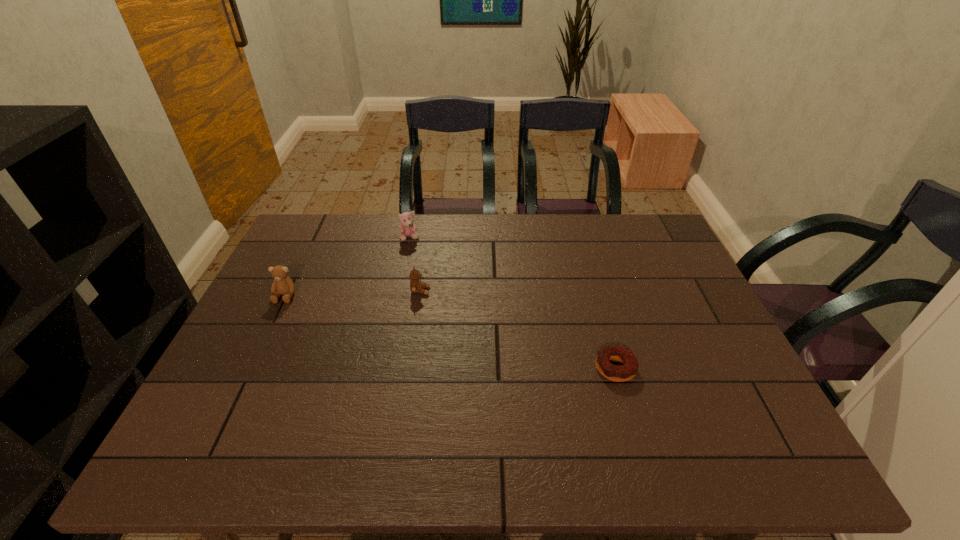
Find the location of a particular element. The height and width of the screenshot is (540, 960). vacant space that's between the leftmost object and the third object from right to left is located at coordinates (348, 267).

The width and height of the screenshot is (960, 540). I want to click on vacant region between the second teddy bear from left to right and the doughnut, so click(513, 303).

The image size is (960, 540). In order to click on free space between the nearest object and the second teddy bear from left to right in this screenshot , I will do `click(513, 303)`.

Find the location of a particular element. This screenshot has width=960, height=540. vacant area that lies between the second object from left to right and the rightmost teddy bear is located at coordinates (415, 264).

At what (x,y) coordinates should I click in order to perform the action: click on free spot between the farthest teddy bear and the leftmost teddy bear. Please return your answer as a coordinate pair (x, y). This screenshot has width=960, height=540. Looking at the image, I should click on (348, 267).

This screenshot has height=540, width=960. What are the coordinates of `vacant point located between the rightmost teddy bear and the nearest object` in the screenshot? It's located at (517, 329).

I want to click on free spot between the leftmost object and the farthest object, so pyautogui.click(x=348, y=267).

At what (x,y) coordinates should I click in order to perform the action: click on free spot between the third object from left to right and the third object from right to left. Please return your answer as a coordinate pair (x, y). The image size is (960, 540). Looking at the image, I should click on (415, 264).

Locate an element on the screen. Image resolution: width=960 pixels, height=540 pixels. vacant space that's between the shortest object and the shortest teddy bear is located at coordinates (517, 329).

Point out which object is positioned as the second nearest to the shortest teddy bear. Please provide its 2D coordinates. Your answer should be formatted as a tuple, i.e. [(x, y)], where the tuple contains the x and y coordinates of a point satisfying the conditions above.

[(282, 285)]